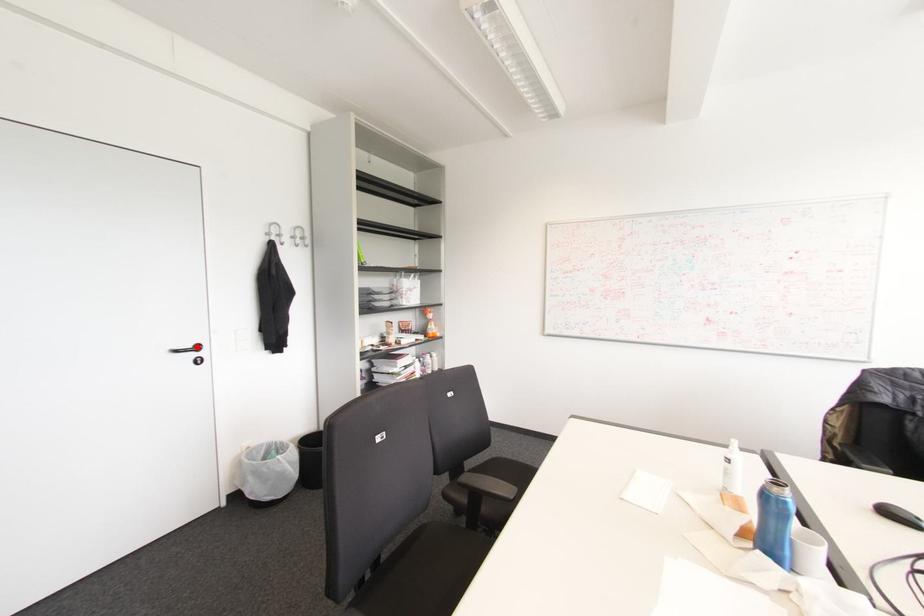
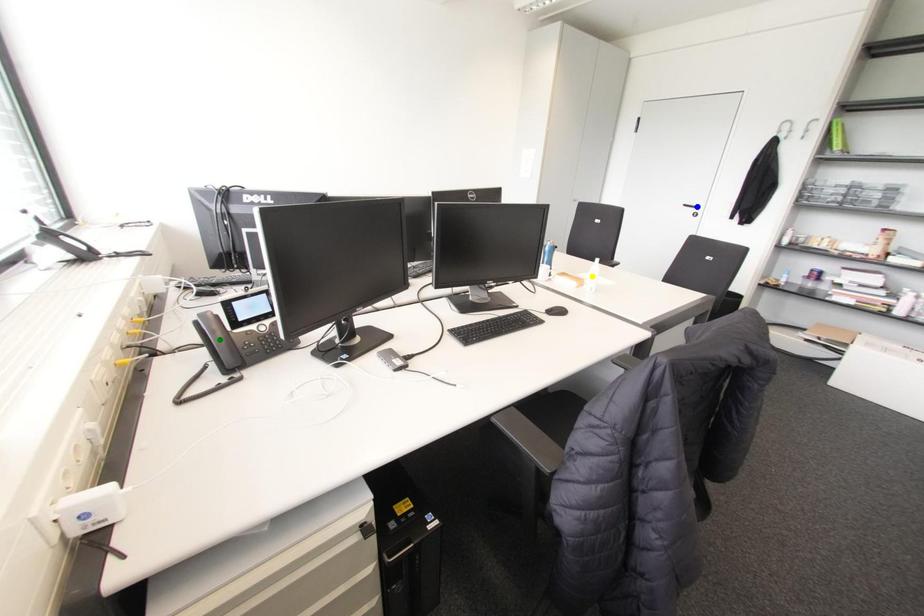
Question: I am providing you with two images of the same scene from different viewpoints. A red point is marked on the first image. You are given multiple points on the second image. Which mark in image 2 goes with the point in image 1?

Choices:
 (A) green point
 (B) blue point
 (C) yellow point

Answer: (B)